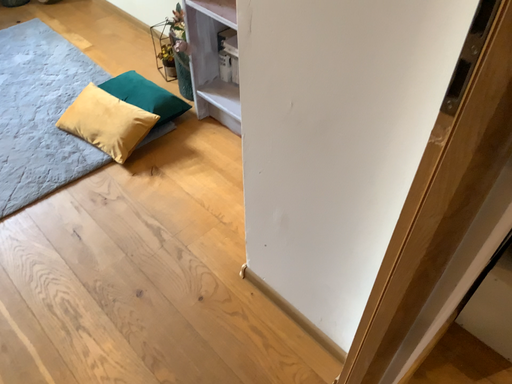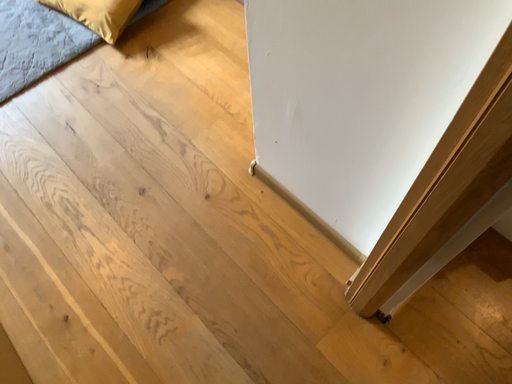
Question: How did the camera likely rotate when shooting the video?

Choices:
 (A) rotated upward
 (B) rotated downward

Answer: (B)